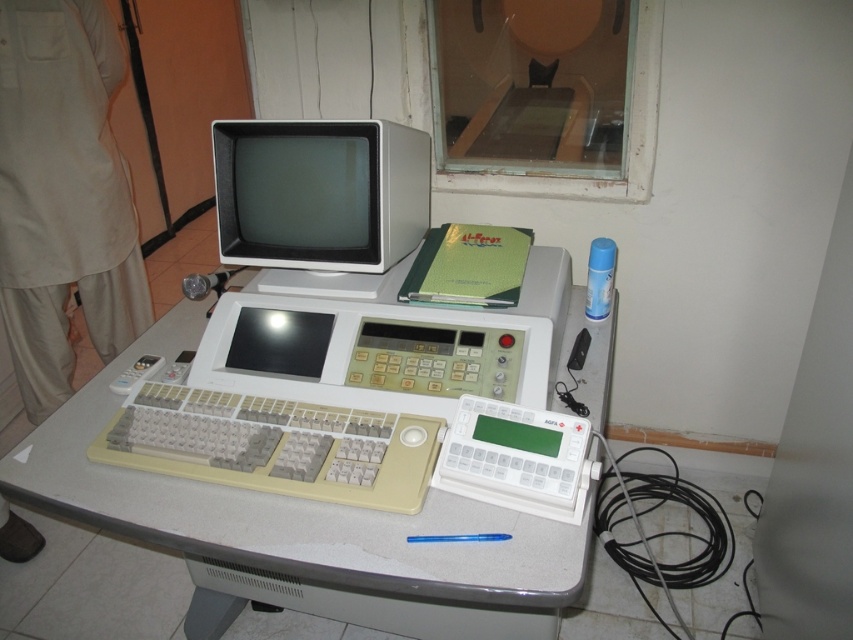
Which is more to the right, white plastic table at center or matte white monitor at center?

white plastic table at center is more to the right.

Between white plastic table at center and matte white monitor at center, which one has more height?

white plastic table at center

Who is more forward, (200, 387) or (405, 188)?

Point (200, 387) is in front.

Identify the location of white plastic table at center. This screenshot has height=640, width=853. (332, 502).

Which is more to the left, matte white monitor at center or beige plastic keyboard at center?

From the viewer's perspective, beige plastic keyboard at center appears more on the left side.

Which of these two, matte white monitor at center or beige plastic keyboard at center, stands taller?

Standing taller between the two is matte white monitor at center.

At what (x,y) coordinates should I click in order to perform the action: click on matte white monitor at center. Please return your answer as a coordinate pair (x, y). This screenshot has width=853, height=640. Looking at the image, I should click on (320, 193).

Locate an element on the screen. The height and width of the screenshot is (640, 853). matte white monitor at center is located at coordinates (320, 193).

Does white plastic table at center appear on the left side of beige plastic keyboard at center?

Incorrect, white plastic table at center is not on the left side of beige plastic keyboard at center.

Where is `white plastic table at center`? The image size is (853, 640). white plastic table at center is located at coordinates pos(332,502).